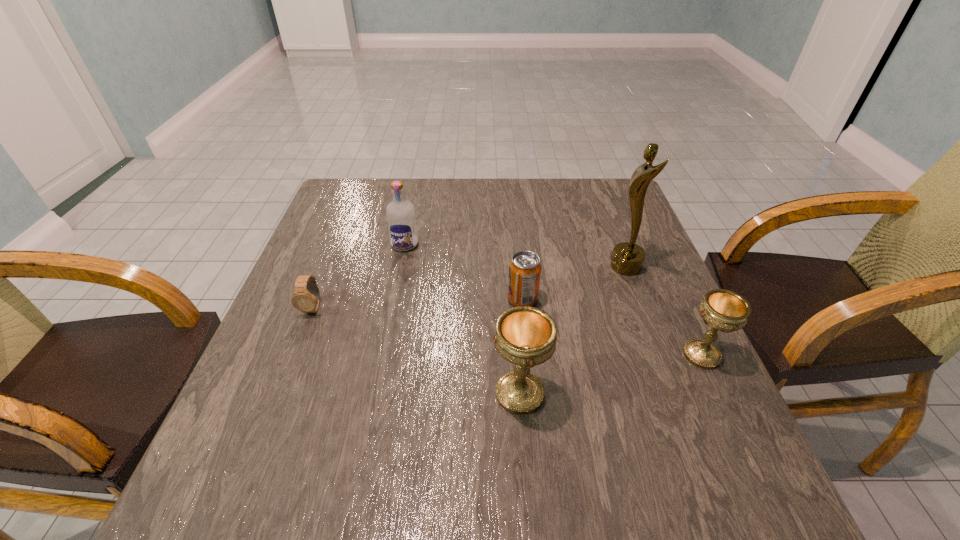
Locate an element on the screen. This screenshot has height=540, width=960. award at the right edge is located at coordinates (627, 258).

Identify the location of blank space at the far edge of the desktop. Image resolution: width=960 pixels, height=540 pixels. (415, 200).

Find the location of a particular element. The height and width of the screenshot is (540, 960). free space at the near edge is located at coordinates (619, 438).

Where is `vacant space at the left edge of the desktop`? The width and height of the screenshot is (960, 540). vacant space at the left edge of the desktop is located at coordinates (359, 269).

In the image, there is a desktop. Where is `vacant space at the right edge`? This screenshot has height=540, width=960. vacant space at the right edge is located at coordinates (597, 243).

Find the location of `vacant area at the far left corner`. vacant area at the far left corner is located at coordinates (330, 209).

Locate an element on the screen. This screenshot has width=960, height=540. vacant region at the far right corner of the desktop is located at coordinates (604, 217).

This screenshot has height=540, width=960. I want to click on vacant space at the near right corner of the desktop, so click(731, 434).

Identify the location of vacant point located between the shortest object and the second shortest object. (418, 303).

Where is `unoccupied area between the taller chalice and the fifth object from right to left`? The image size is (960, 540). unoccupied area between the taller chalice and the fifth object from right to left is located at coordinates (463, 319).